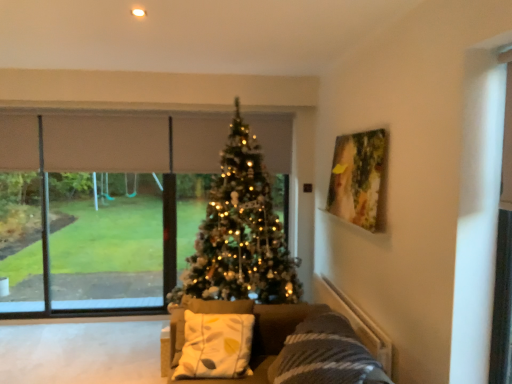
Question: Should I look upward or downward to see transparent glass screen door at right?

Choices:
 (A) down
 (B) up

Answer: (A)

Question: Is wooden painting at upper right inside transparent glass screen door at right?

Choices:
 (A) no
 (B) yes

Answer: (A)

Question: Is transparent glass screen door at right positioned in front of wooden painting at upper right?

Choices:
 (A) no
 (B) yes

Answer: (B)

Question: Considering the relative sizes of transparent glass screen door at right and wooden painting at upper right in the image provided, is transparent glass screen door at right wider than wooden painting at upper right?

Choices:
 (A) no
 (B) yes

Answer: (A)

Question: Is transparent glass screen door at right outside of wooden painting at upper right?

Choices:
 (A) no
 (B) yes

Answer: (B)

Question: From the image's perspective, does transparent glass screen door at right appear higher than wooden painting at upper right?

Choices:
 (A) yes
 (B) no

Answer: (B)

Question: Considering the relative positions of transparent glass screen door at right and wooden painting at upper right in the image provided, is transparent glass screen door at right behind wooden painting at upper right?

Choices:
 (A) no
 (B) yes

Answer: (A)

Question: Would you say transparent glass window at center is outside white fabric pillow at center?

Choices:
 (A) yes
 (B) no

Answer: (A)

Question: Is transparent glass window at center oriented away from white fabric pillow at center?

Choices:
 (A) no
 (B) yes

Answer: (A)

Question: From the image's perspective, is transparent glass window at center on white fabric pillow at center?

Choices:
 (A) no
 (B) yes

Answer: (B)

Question: Is transparent glass window at center bigger than white fabric pillow at center?

Choices:
 (A) no
 (B) yes

Answer: (B)

Question: From a real-world perspective, is transparent glass window at center over white fabric pillow at center?

Choices:
 (A) yes
 (B) no

Answer: (A)

Question: Considering the relative sizes of transparent glass window at center and white fabric pillow at center in the image provided, is transparent glass window at center shorter than white fabric pillow at center?

Choices:
 (A) no
 (B) yes

Answer: (A)

Question: From a real-world perspective, is iridescent gold christmas tree at center over transparent glass window at center?

Choices:
 (A) no
 (B) yes

Answer: (B)